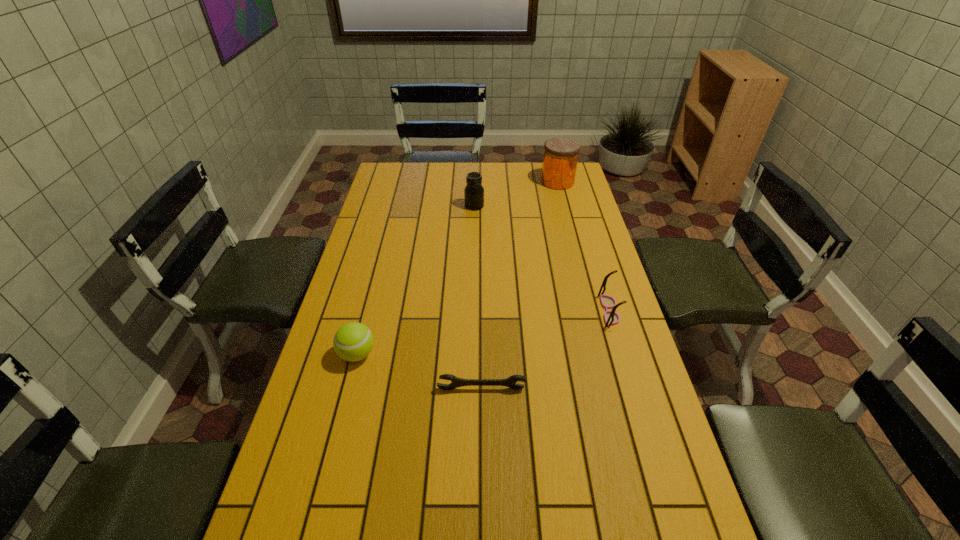
I want to click on free space located 0.340m on the left of the nearer jar, so click(382, 206).

At what (x,y) coordinates should I click in order to perform the action: click on blank space located on the left of the third farthest object. Please return your answer as a coordinate pair (x, y). The image size is (960, 540). Looking at the image, I should click on (552, 311).

Find the location of a particular element. vacant space located 0.230m on the back of the tennis ball is located at coordinates (374, 286).

Locate an element on the screen. free space located on the open ends of the shortest object is located at coordinates (482, 425).

Where is `object situated at the far edge`? The image size is (960, 540). object situated at the far edge is located at coordinates (560, 159).

You are a GUI agent. You are given a task and a screenshot of the screen. Output one action in this format:
    pyautogui.click(x=<x>, y=<y>)
    Task: Click on the object that is at the left edge
    
    Given the screenshot: What is the action you would take?
    pyautogui.click(x=353, y=341)

What are the coordinates of `jar that is at the right edge` in the screenshot? It's located at (560, 159).

The height and width of the screenshot is (540, 960). In order to click on spectacles that is positioned at the right edge in this screenshot , I will do `click(611, 318)`.

The image size is (960, 540). In order to click on object positioned at the far right corner in this screenshot , I will do `click(560, 159)`.

Image resolution: width=960 pixels, height=540 pixels. In order to click on vacant space at the far edge of the desktop in this screenshot , I will do `click(477, 163)`.